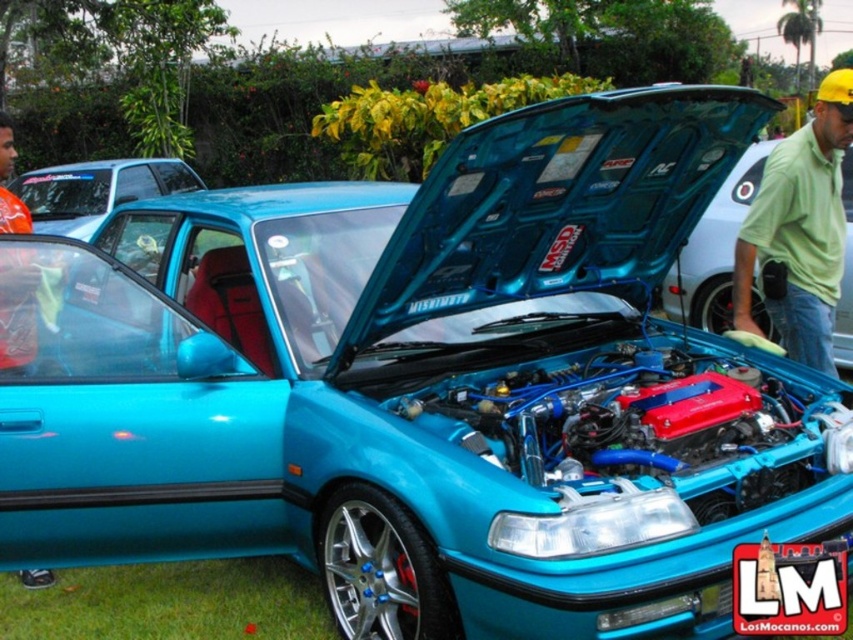
Question: Does green cotton shirt at upper right appear over orange fabric shirt at left?

Choices:
 (A) yes
 (B) no

Answer: (A)

Question: Which object is closer to the camera taking this photo?

Choices:
 (A) green cotton shirt at upper right
 (B) orange fabric shirt at left

Answer: (B)

Question: Is green cotton shirt at upper right in front of orange fabric shirt at left?

Choices:
 (A) yes
 (B) no

Answer: (B)

Question: Is green cotton shirt at upper right further to the viewer compared to orange fabric shirt at left?

Choices:
 (A) yes
 (B) no

Answer: (A)

Question: Among these points, which one is farthest from the camera?

Choices:
 (A) (838, 170)
 (B) (51, 580)

Answer: (A)

Question: Which object is farther from the camera taking this photo?

Choices:
 (A) green cotton shirt at upper right
 (B) orange fabric shirt at left

Answer: (A)